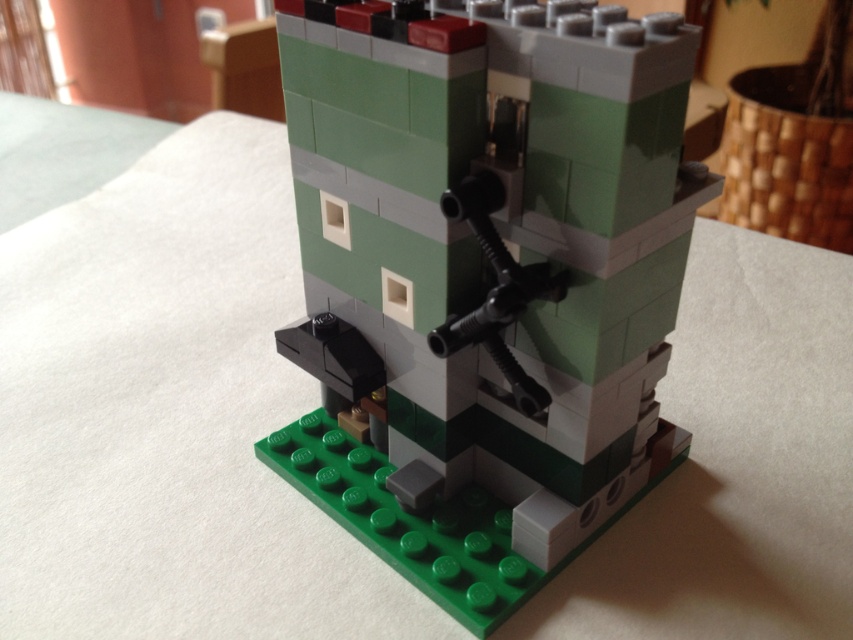
Question: Is green matte tower at center positioned at the back of black plastic gun at center?

Choices:
 (A) yes
 (B) no

Answer: (B)

Question: Is green matte tower at center closer to the viewer compared to black plastic gun at center?

Choices:
 (A) no
 (B) yes

Answer: (B)

Question: Which point is farther from the camera taking this photo?

Choices:
 (A) (396, 426)
 (B) (491, 253)

Answer: (A)

Question: Can you confirm if green matte tower at center is wider than black plastic gun at center?

Choices:
 (A) yes
 (B) no

Answer: (A)